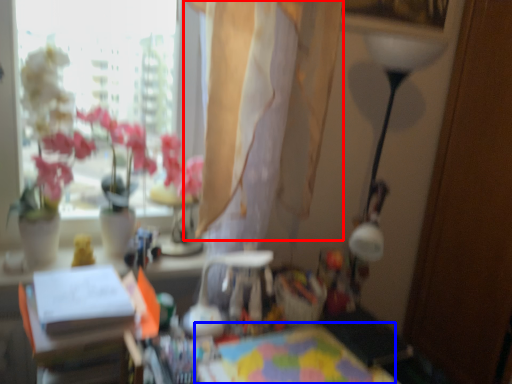
Question: Which object appears closest to the camera in this image, curtain (highlighted by a red box) or table (highlighted by a blue box)?

Choices:
 (A) curtain
 (B) table

Answer: (B)